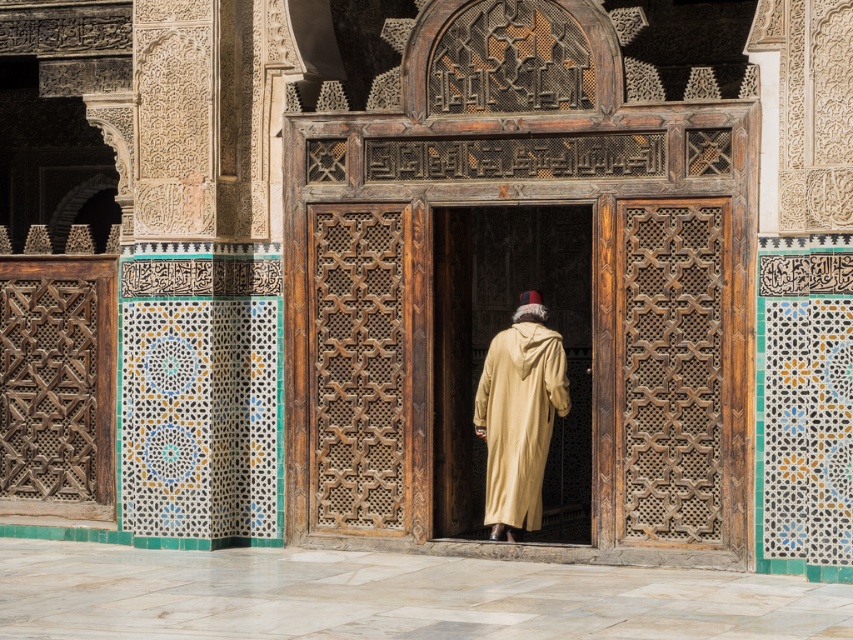
You are an architect analyzing the layout of this historical building. Based on the scene, where is the wooden door at center positioned in terms of its 2D coordinates?

The wooden door at center is positioned at coordinates (486, 348).

You are an architect designing a new building inspired by this historical style. You need to place both the wooden carved door at center and the beige woolen robe at center in your design. Which object should you allocate more space for, and why?

You should allocate more space for the beige woolen robe at center because the wooden carved door at center occupies less space than the beige woolen robe at center according to the description.